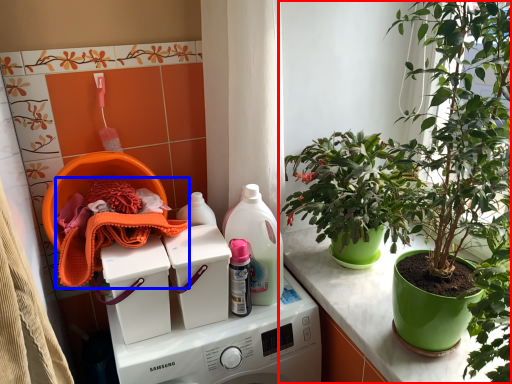
Question: Among these objects, which one is farthest to the camera, houseplant (highlighted by a red box) or material (highlighted by a blue box)?

Choices:
 (A) houseplant
 (B) material

Answer: (B)